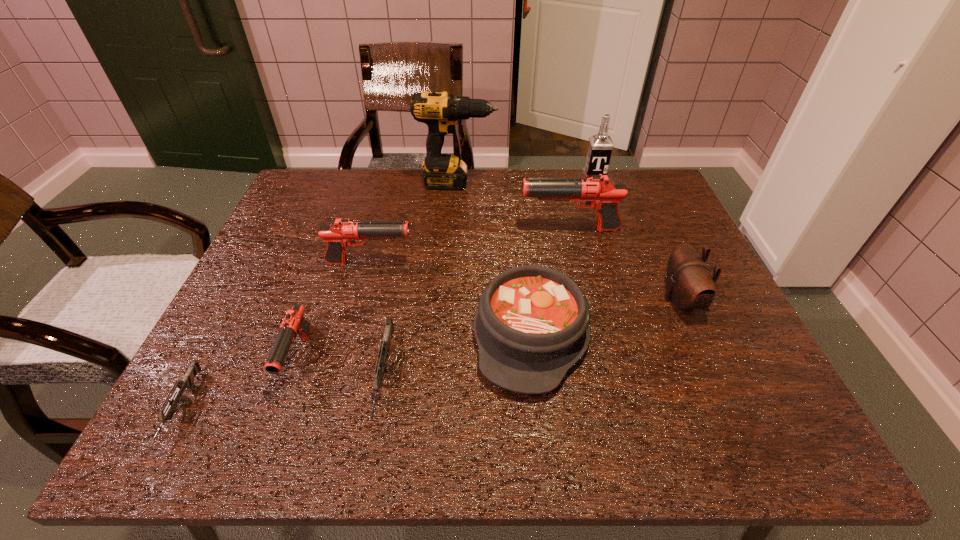
Locate an element on the screen. This screenshot has height=540, width=960. vacant space that satisfies the following two spatial constraints: 1. at the tip of the drill; 2. on the back side of the casserole is located at coordinates (447, 334).

This screenshot has width=960, height=540. What are the coordinates of `blank area in the image that satisfies the following two spatial constraints: 1. at the aiming end of the farthest black gun; 2. aimed along the barrel of the leftmost object` in the screenshot? It's located at (612, 409).